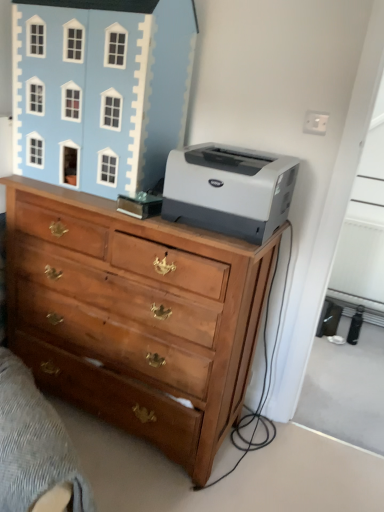
Question: Is light blue painted wood dollhouse at upper left bigger than wooden chest of drawers at center?

Choices:
 (A) no
 (B) yes

Answer: (A)

Question: Is light blue painted wood dollhouse at upper left to the left of wooden chest of drawers at center from the viewer's perspective?

Choices:
 (A) yes
 (B) no

Answer: (A)

Question: Is light blue painted wood dollhouse at upper left surrounding wooden chest of drawers at center?

Choices:
 (A) no
 (B) yes

Answer: (A)

Question: From a real-world perspective, is light blue painted wood dollhouse at upper left physically above wooden chest of drawers at center?

Choices:
 (A) yes
 (B) no

Answer: (A)

Question: Is the depth of light blue painted wood dollhouse at upper left less than that of wooden chest of drawers at center?

Choices:
 (A) no
 (B) yes

Answer: (A)

Question: In terms of width, does wooden drawer at lower left look wider or thinner when compared to gray matte printer at upper right?

Choices:
 (A) wide
 (B) thin

Answer: (A)

Question: Is point (139, 404) positioned closer to the camera than point (188, 205)?

Choices:
 (A) closer
 (B) farther

Answer: (B)

Question: Choose the correct answer: Is wooden drawer at lower left inside gray matte printer at upper right or outside it?

Choices:
 (A) outside
 (B) inside

Answer: (A)

Question: From a real-world perspective, is wooden drawer at lower left physically located above or below gray matte printer at upper right?

Choices:
 (A) above
 (B) below

Answer: (B)

Question: Is gray matte printer at upper right in front of or behind light blue painted wood dollhouse at upper left in the image?

Choices:
 (A) front
 (B) behind

Answer: (A)

Question: Considering the positions of point (180, 161) and point (145, 66), is point (180, 161) closer or farther from the camera than point (145, 66)?

Choices:
 (A) closer
 (B) farther

Answer: (A)

Question: From a real-world perspective, relative to light blue painted wood dollhouse at upper left, is gray matte printer at upper right vertically above or below?

Choices:
 (A) above
 (B) below

Answer: (B)

Question: Looking at the image, does gray matte printer at upper right seem bigger or smaller compared to light blue painted wood dollhouse at upper left?

Choices:
 (A) big
 (B) small

Answer: (B)

Question: From a real-world perspective, is light blue painted wood dollhouse at upper left physically located above or below wooden chest of drawers at center?

Choices:
 (A) above
 (B) below

Answer: (A)

Question: Is point (165, 130) positioned closer to the camera than point (132, 219)?

Choices:
 (A) farther
 (B) closer

Answer: (A)